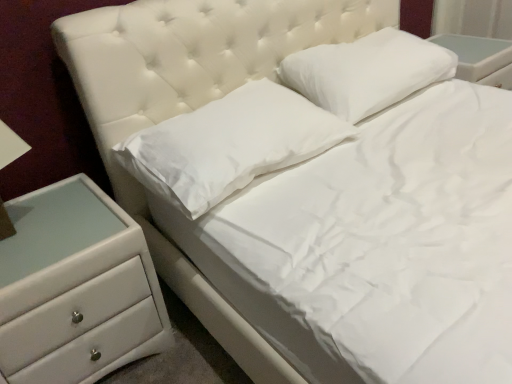
You are a GUI agent. You are given a task and a screenshot of the screen. Output one action in this format:
    pyautogui.click(x=<x>, y=<y>)
    Task: Click on the white soft pillow at center, which is the 2th pillow in right-to-left order
    
    Given the screenshot: What is the action you would take?
    pyautogui.click(x=229, y=144)

Identify the location of white glossy chest of drawers at lower left. This screenshot has width=512, height=384. (76, 287).

What are the coordinates of `white soft pillow at upper center, which appears as the 2th pillow when viewed from the left` in the screenshot? It's located at (367, 72).

You are a GUI agent. You are given a task and a screenshot of the screen. Output one action in this format:
    pyautogui.click(x=<x>, y=<y>)
    Task: Click on the white soft pillow at center, which is the 2th pillow in right-to-left order
    
    Given the screenshot: What is the action you would take?
    pyautogui.click(x=229, y=144)

This screenshot has width=512, height=384. Identify the location of the chest of drawers lying in front of the white soft pillow at upper center, which appears as the 2th pillow when viewed from the left. (76, 287).

In the scene shown: Can you confirm if white soft pillow at upper center, which appears as the 2th pillow when viewed from the left, is taller than white glossy chest of drawers at lower left?

No, white soft pillow at upper center, which appears as the 2th pillow when viewed from the left, is not taller than white glossy chest of drawers at lower left.

Is white soft pillow at upper center, which appears as the 2th pillow when viewed from the left, positioned with its back to white glossy chest of drawers at lower left?

No, white soft pillow at upper center, which appears as the 2th pillow when viewed from the left, is not facing the opposite direction of white glossy chest of drawers at lower left.

From a real-world perspective, who is located higher, white soft pillow at upper center, which appears as the 2th pillow when viewed from the left, or white glossy chest of drawers at lower left?

From a 3D spatial view, white soft pillow at upper center, which appears as the 2th pillow when viewed from the left, is above.

From a real-world perspective, is white glossy chest of drawers at lower left positioned above or below white soft pillow at upper center, which is counted as the 1th pillow, starting from the right?

white glossy chest of drawers at lower left is situated lower than white soft pillow at upper center, which is counted as the 1th pillow, starting from the right, in the real world.

Can you confirm if white glossy chest of drawers at lower left is smaller than white soft pillow at upper center, which appears as the 2th pillow when viewed from the left?

Actually, white glossy chest of drawers at lower left might be larger than white soft pillow at upper center, which appears as the 2th pillow when viewed from the left.

How many degrees apart are the facing directions of white glossy chest of drawers at lower left and white soft pillow at upper center, which is counted as the 1th pillow, starting from the right?

1.81 degrees.

Between point (47, 312) and point (380, 90), which one is positioned in front?

The point (47, 312) is more forward.

The image size is (512, 384). Find the location of `pillow above the white soft pillow at center, which ranks as the first pillow in left-to-right order (from the image's perspective)`. pillow above the white soft pillow at center, which ranks as the first pillow in left-to-right order (from the image's perspective) is located at coordinates (367, 72).

How different are the orientations of white soft pillow at center, which ranks as the first pillow in left-to-right order, and white soft pillow at upper center, which appears as the 2th pillow when viewed from the left, in degrees?

The angle between the facing direction of white soft pillow at center, which ranks as the first pillow in left-to-right order, and the facing direction of white soft pillow at upper center, which appears as the 2th pillow when viewed from the left, is 0.000163 degrees.

From their relative heights in the image, would you say white soft pillow at center, which is the 2th pillow in right-to-left order, is taller or shorter than white soft pillow at upper center, which is counted as the 1th pillow, starting from the right?

Clearly, white soft pillow at center, which is the 2th pillow in right-to-left order, is shorter compared to white soft pillow at upper center, which is counted as the 1th pillow, starting from the right.

Which is nearer, (402,62) or (277,85)?

The point (277,85) is in front.

Can you tell me how much white soft pillow at upper center, which appears as the 2th pillow when viewed from the left, and white soft pillow at center, which is the 2th pillow in right-to-left order, differ in facing direction?

The facing directions of white soft pillow at upper center, which appears as the 2th pillow when viewed from the left, and white soft pillow at center, which is the 2th pillow in right-to-left order, are 0.000163 degrees apart.

From the picture: Is white soft pillow at upper center, which appears as the 2th pillow when viewed from the left, taller than white soft pillow at center, which ranks as the first pillow in left-to-right order?

Yes.

Is white soft pillow at upper center, which is counted as the 1th pillow, starting from the right, beside white soft pillow at center, which ranks as the first pillow in left-to-right order?

white soft pillow at upper center, which is counted as the 1th pillow, starting from the right, and white soft pillow at center, which ranks as the first pillow in left-to-right order, are clearly separated.

Is white soft pillow at center, which is the 2th pillow in right-to-left order, aimed at white glossy chest of drawers at lower left?

No.

Between white soft pillow at center, which is the 2th pillow in right-to-left order, and white glossy chest of drawers at lower left, which one has smaller size?

white soft pillow at center, which is the 2th pillow in right-to-left order, is smaller.

From the picture: How distant is white soft pillow at center, which is the 2th pillow in right-to-left order, from white glossy chest of drawers at lower left?

white soft pillow at center, which is the 2th pillow in right-to-left order, and white glossy chest of drawers at lower left are 13.97 inches apart from each other.

From a real-world perspective, which object rests below the other?

In real-world perspective, white glossy chest of drawers at lower left is lower.

Starting from the white glossy chest of drawers at lower left, which pillow is the 1st one behind? Please provide its 2D coordinates.

[(229, 144)]

Looking at this image, what's the angular difference between white glossy chest of drawers at lower left and white soft pillow at center, which is the 2th pillow in right-to-left order,'s facing directions?

The angle between the facing direction of white glossy chest of drawers at lower left and the facing direction of white soft pillow at center, which is the 2th pillow in right-to-left order, is 1.81 degrees.

Locate an element on the screen. The width and height of the screenshot is (512, 384). the chest of drawers below the white soft pillow at upper center, which is counted as the 1th pillow, starting from the right (from a real-world perspective) is located at coordinates (76, 287).

Identify the location of chest of drawers on the left of white soft pillow at upper center, which is counted as the 1th pillow, starting from the right. (76, 287).

Considering their positions, is white soft pillow at center, which is the 2th pillow in right-to-left order, positioned further to white glossy chest of drawers at lower left than white soft pillow at upper center, which appears as the 2th pillow when viewed from the left?

white soft pillow at upper center, which appears as the 2th pillow when viewed from the left, lies further to white glossy chest of drawers at lower left than the other object.

Based on their spatial positions, is white glossy chest of drawers at lower left or white soft pillow at center, which ranks as the first pillow in left-to-right order, closer to white soft pillow at upper center, which appears as the 2th pillow when viewed from the left?

white soft pillow at center, which ranks as the first pillow in left-to-right order, is closer to white soft pillow at upper center, which appears as the 2th pillow when viewed from the left.

From the image, which object appears to be nearer to white soft pillow at upper center, which appears as the 2th pillow when viewed from the left, white soft pillow at center, which ranks as the first pillow in left-to-right order, or white glossy chest of drawers at lower left?

Based on the image, white soft pillow at center, which ranks as the first pillow in left-to-right order, appears to be nearer to white soft pillow at upper center, which appears as the 2th pillow when viewed from the left.

When comparing their distances from white soft pillow at center, which is the 2th pillow in right-to-left order, does white glossy chest of drawers at lower left or white soft pillow at upper center, which is counted as the 1th pillow, starting from the right, seem closer?

Based on the image, white glossy chest of drawers at lower left appears to be nearer to white soft pillow at center, which is the 2th pillow in right-to-left order.

Considering their positions, is white soft pillow at upper center, which appears as the 2th pillow when viewed from the left, positioned further to white glossy chest of drawers at lower left than white soft pillow at center, which is the 2th pillow in right-to-left order?

white soft pillow at upper center, which appears as the 2th pillow when viewed from the left, is further to white glossy chest of drawers at lower left.

Looking at this image, when comparing their distances from white soft pillow at center, which ranks as the first pillow in left-to-right order, does white soft pillow at upper center, which is counted as the 1th pillow, starting from the right, or white glossy chest of drawers at lower left seem further?

Among the two, white soft pillow at upper center, which is counted as the 1th pillow, starting from the right, is located further to white soft pillow at center, which ranks as the first pillow in left-to-right order.

What are the coordinates of `pillow between white glossy chest of drawers at lower left and white soft pillow at upper center, which is counted as the 1th pillow, starting from the right, from left to right` in the screenshot? It's located at (229, 144).